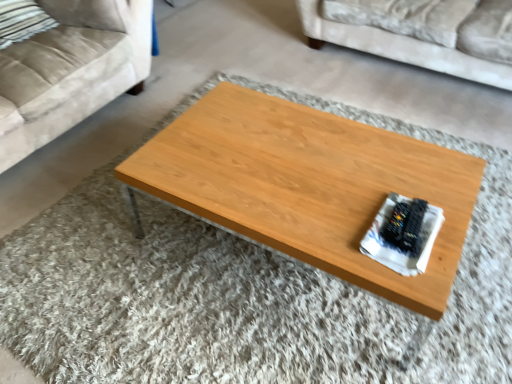
Question: Would you say woodenmaterial/texturecoffee table at center is to the left or to the right of beige fabric pillow at upper left, which is counted as the second pillow, starting from the left, in the picture?

Choices:
 (A) right
 (B) left

Answer: (A)

Question: From a real-world perspective, relative to beige fabric pillow at upper left, the first pillow viewed from the right, is woodenmaterial/texturecoffee table at center vertically above or below?

Choices:
 (A) below
 (B) above

Answer: (A)

Question: Estimate the real-world distances between objects in this image. Which object is closer to the woodenmaterial/texturecoffee table at center?

Choices:
 (A) suede beige couch at upper left, which appears as the 1th studio couch when viewed from the left
 (B) velvet beige couch at upper right, which is the first studio couch in right-to-left order
 (C) beige fabric pillow at upper left, the first pillow viewed from the right
 (D) striped fabric pillow at upper left, arranged as the 1th pillow when viewed from the left

Answer: (A)

Question: Which object is positioned closest to the striped fabric pillow at upper left, arranged as the 1th pillow when viewed from the left?

Choices:
 (A) beige fabric pillow at upper left, the first pillow viewed from the right
 (B) woodenmaterial/texturecoffee table at center
 (C) velvet beige couch at upper right, the second studio couch when ordered from left to right
 (D) suede beige couch at upper left, which appears as the 1th studio couch when viewed from the left

Answer: (A)